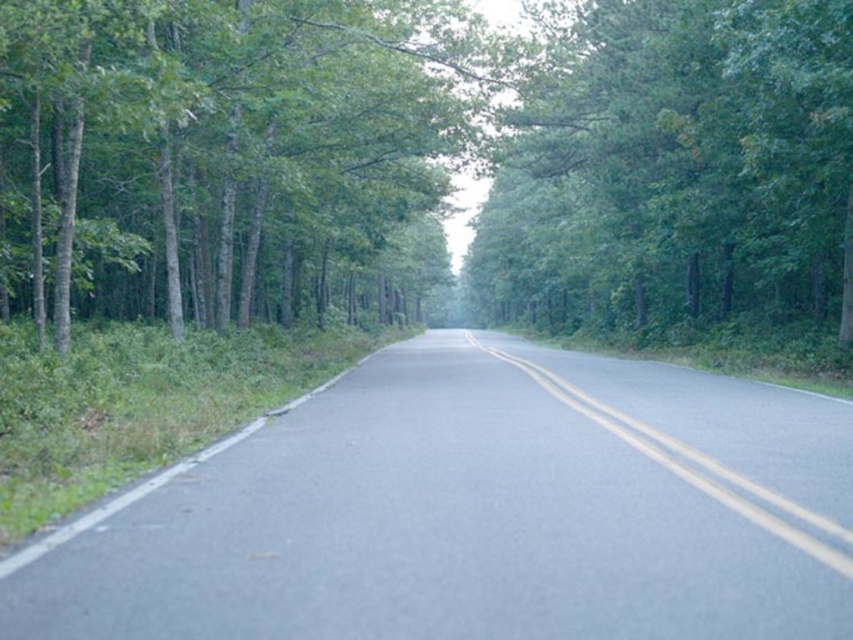
Can you confirm if green leafy tree at upper center is positioned above yellow asphalt road at center?

Yes, green leafy tree at upper center is above yellow asphalt road at center.

Can you confirm if green leafy tree at upper center is wider than yellow asphalt road at center?

Yes, green leafy tree at upper center is wider than yellow asphalt road at center.

The width and height of the screenshot is (853, 640). I want to click on green leafy tree at upper center, so click(676, 170).

Who is higher up, green leafy tree at center or green leafy tree at upper center?

Positioned higher is green leafy tree at center.

Is green leafy tree at center shorter than green leafy tree at upper center?

Incorrect, green leafy tree at center's height does not fall short of green leafy tree at upper center's.

Describe the element at coordinates (427, 160) in the screenshot. I see `green leafy tree at center` at that location.

This screenshot has height=640, width=853. Identify the location of green leafy tree at center. (427, 160).

Is point (775, 227) closer to camera compared to point (827, 524)?

No, (775, 227) is behind (827, 524).

This screenshot has height=640, width=853. In order to click on green leafy tree at center in this screenshot , I will do `click(427, 160)`.